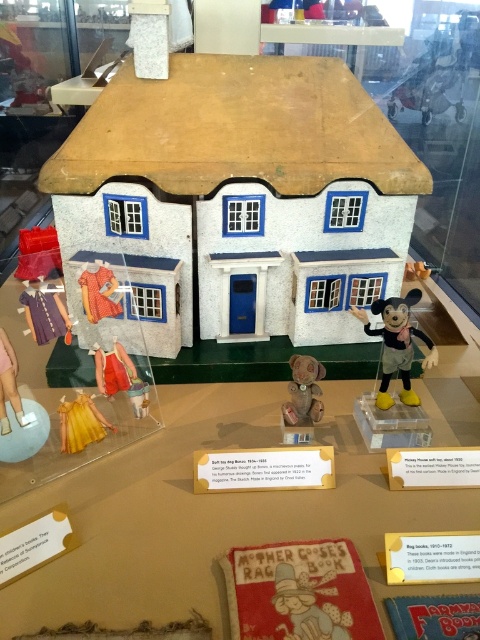
Question: Does matte plastic mickey mouse at right come in front of yellow satin dress at lower left?

Choices:
 (A) no
 (B) yes

Answer: (A)

Question: Can you confirm if matte plastic mickey mouse at right is positioned to the left of yellow satin dress at lower left?

Choices:
 (A) no
 (B) yes

Answer: (A)

Question: Which object appears closest to the camera in this image?

Choices:
 (A) matte red dress at lower left
 (B) matte brown plush bear at center
 (C) matte plastic mickey mouse at right
 (D) yellow satin dress at lower left

Answer: (D)

Question: Based on their relative distances, which object is nearer to the matte plastic mickey mouse at right?

Choices:
 (A) matte brown plush bear at center
 (B) yellow satin dress at lower left

Answer: (A)

Question: Is matte plastic mickey mouse at right bigger than yellow satin dress at lower left?

Choices:
 (A) yes
 (B) no

Answer: (A)

Question: Which of the following is the farthest from the observer?

Choices:
 (A) matte red dress at lower left
 (B) yellow satin dress at lower left
 (C) matte brown plush bear at center
 (D) matte plastic mickey mouse at right

Answer: (A)